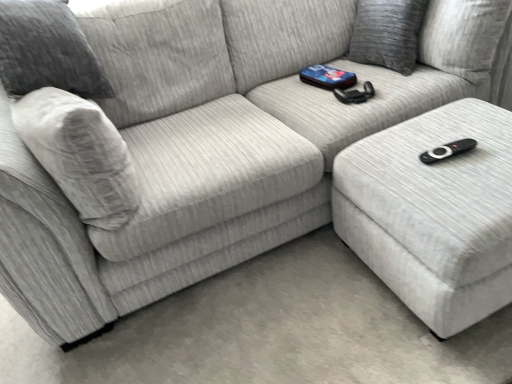
Question: Is white fabric ottoman at lower right at the right side of gray fabric pillow at upper right?

Choices:
 (A) yes
 (B) no

Answer: (A)

Question: From the image's perspective, would you say white fabric ottoman at lower right is positioned over gray fabric pillow at upper right?

Choices:
 (A) yes
 (B) no

Answer: (B)

Question: From a real-world perspective, is white fabric ottoman at lower right positioned over gray fabric pillow at upper right based on gravity?

Choices:
 (A) yes
 (B) no

Answer: (B)

Question: Considering the relative positions of white fabric ottoman at lower right and gray fabric pillow at upper right in the image provided, is white fabric ottoman at lower right to the left of gray fabric pillow at upper right from the viewer's perspective?

Choices:
 (A) yes
 (B) no

Answer: (B)

Question: Can you confirm if white fabric ottoman at lower right is thinner than gray fabric pillow at upper right?

Choices:
 (A) yes
 (B) no

Answer: (B)

Question: Is there a large distance between white fabric ottoman at lower right and gray fabric pillow at upper right?

Choices:
 (A) yes
 (B) no

Answer: (B)

Question: Is the depth of gray fabric pillow at upper right greater than that of white fabric ottoman at lower right?

Choices:
 (A) yes
 (B) no

Answer: (A)

Question: Can you confirm if gray fabric pillow at upper right is positioned to the left of white fabric ottoman at lower right?

Choices:
 (A) yes
 (B) no

Answer: (A)

Question: From a real-world perspective, is gray fabric pillow at upper right on white fabric ottoman at lower right?

Choices:
 (A) yes
 (B) no

Answer: (A)

Question: Can you confirm if gray fabric pillow at upper right is bigger than white fabric ottoman at lower right?

Choices:
 (A) yes
 (B) no

Answer: (B)

Question: Are gray fabric pillow at upper right and white fabric ottoman at lower right making contact?

Choices:
 (A) no
 (B) yes

Answer: (A)

Question: Is the depth of gray fabric pillow at upper right less than that of white fabric ottoman at lower right?

Choices:
 (A) yes
 (B) no

Answer: (B)

Question: In the image, is gray fabric pillow at upper right positioned in front of or behind white fabric ottoman at lower right?

Choices:
 (A) behind
 (B) front

Answer: (A)